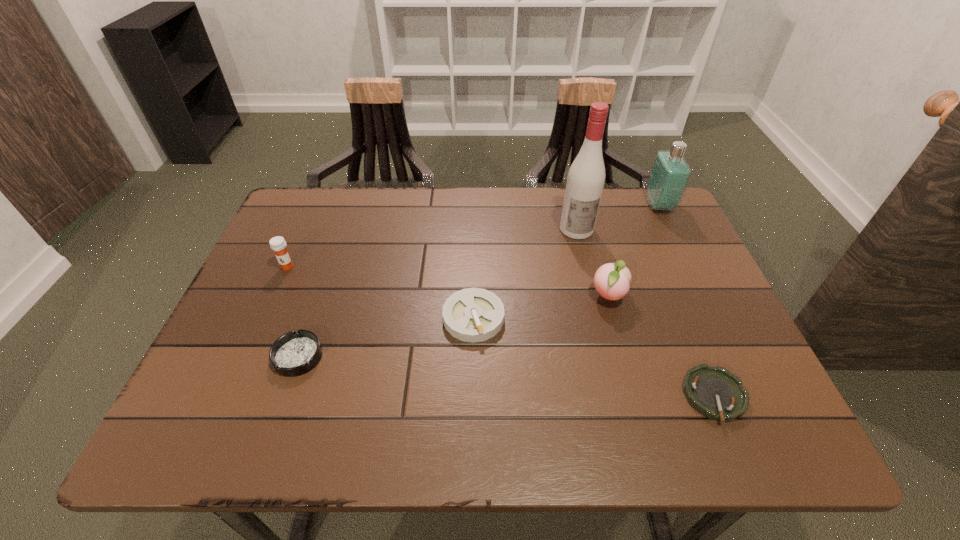
You are a GUI agent. You are given a task and a screenshot of the screen. Output one action in this format:
    pyautogui.click(x=<x>, y=<y>)
    Task: Click on the second tallest ashtray
    
    Given the screenshot: What is the action you would take?
    pyautogui.click(x=295, y=353)

Locate an element on the screen. This screenshot has height=540, width=960. the shortest ashtray is located at coordinates click(x=716, y=393).

Locate an element on the screen. the shortest object is located at coordinates (716, 393).

Identify the location of free space located on the label of the alcohol. Image resolution: width=960 pixels, height=540 pixels. (584, 258).

The image size is (960, 540). Find the location of `free spot located on the front label of the perfume`. free spot located on the front label of the perfume is located at coordinates (624, 205).

Locate an element on the screen. This screenshot has width=960, height=540. vacant space located on the front label of the perfume is located at coordinates click(530, 205).

Identify the location of free space located 0.350m on the front label of the perfume. Image resolution: width=960 pixels, height=540 pixels. (530, 205).

This screenshot has width=960, height=540. I want to click on vacant space located 0.330m on the back of the peach, so click(583, 204).

Find the location of `vacant space located 0.310m on the label side of the leftmost object`. vacant space located 0.310m on the label side of the leftmost object is located at coordinates (238, 377).

Identify the location of free space located 0.110m on the back of the second ashtray from left to right. The width and height of the screenshot is (960, 540). (474, 264).